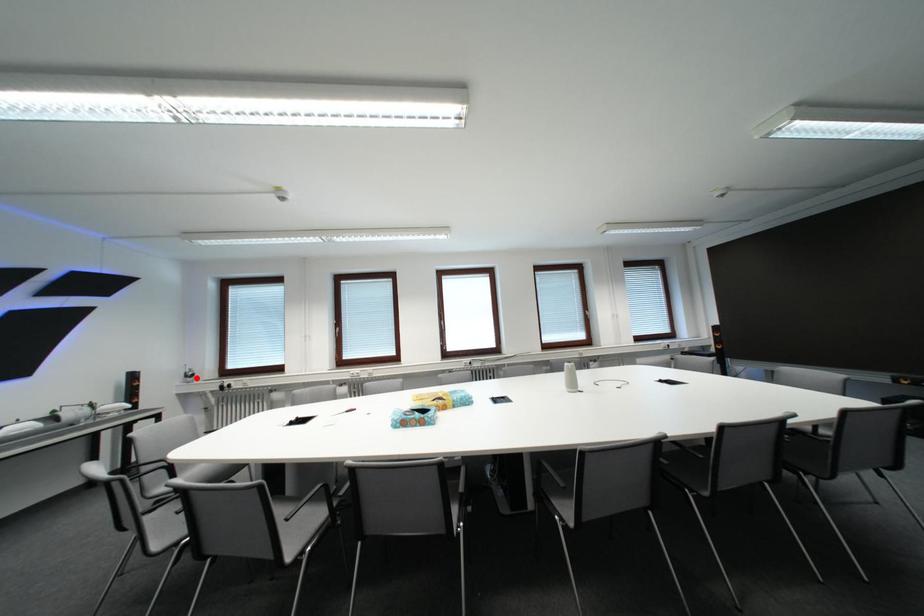
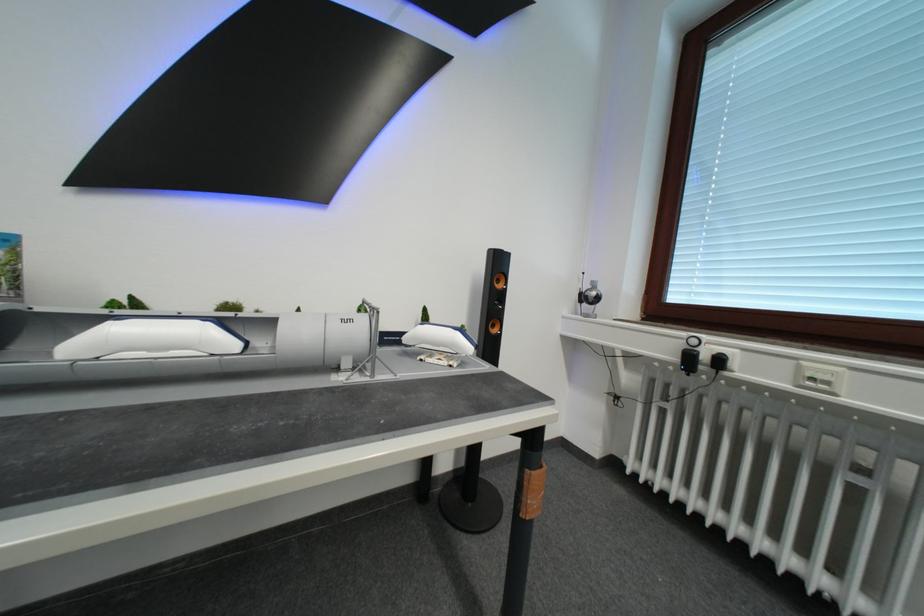
Find the pixel in the second image that matches the highlighted location in the first image.

(592, 301)